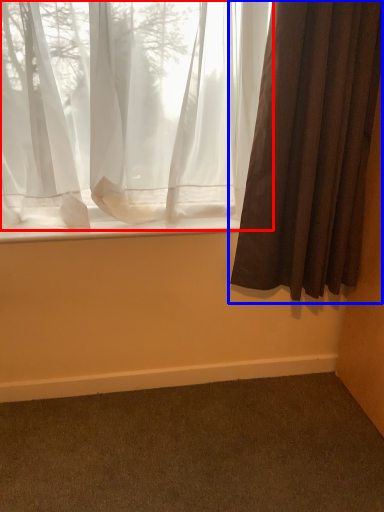
Question: Which point is further to the camera, curtain (highlighted by a red box) or curtain (highlighted by a blue box)?

Choices:
 (A) curtain
 (B) curtain

Answer: (A)